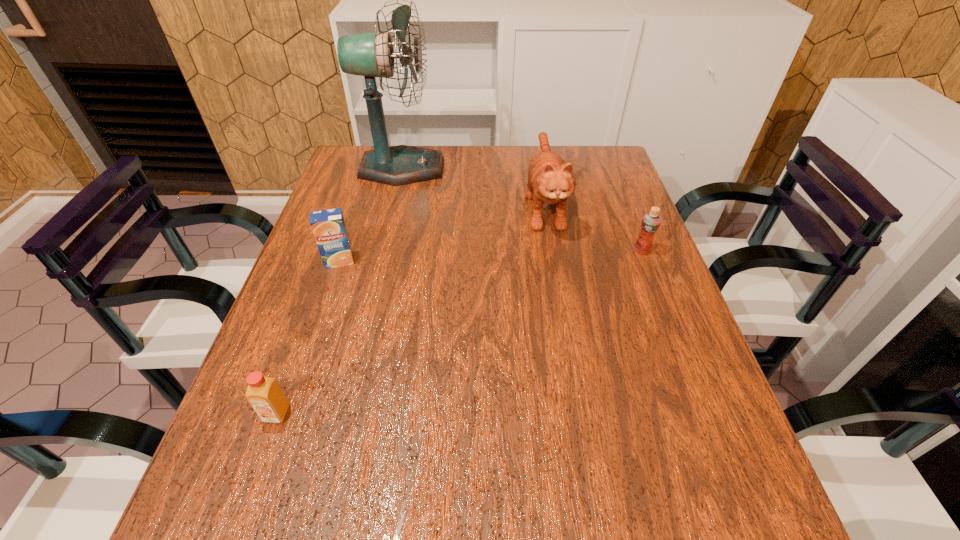
The height and width of the screenshot is (540, 960). I want to click on cat that is positioned at the far edge, so click(x=550, y=180).

Find the location of `fan that is at the left edge`. fan that is at the left edge is located at coordinates (371, 54).

Find the location of a particular element. Image resolution: width=960 pixels, height=540 pixels. object that is positioned at the right edge is located at coordinates (651, 221).

The image size is (960, 540). I want to click on object located in the far left corner section of the desktop, so click(x=371, y=54).

Locate an element on the screen. This screenshot has height=540, width=960. vacant space at the far edge of the desktop is located at coordinates (513, 152).

In order to click on vacant space at the left edge of the desktop in this screenshot , I will do `click(316, 327)`.

In the image, there is a desktop. Identify the location of vacant space at the right edge. This screenshot has width=960, height=540. (636, 332).

The width and height of the screenshot is (960, 540). Identify the location of vacant space at the far right corner of the desktop. (571, 161).

You are a GUI agent. You are given a task and a screenshot of the screen. Output one action in this format:
    pyautogui.click(x=<x>, y=<y>)
    Task: Click on the free spot between the tallest object and the nearest object
    
    Given the screenshot: What is the action you would take?
    pyautogui.click(x=340, y=291)

Find the location of `free space between the tallest object and the nearest orange juice`. free space between the tallest object and the nearest orange juice is located at coordinates [x=340, y=291].